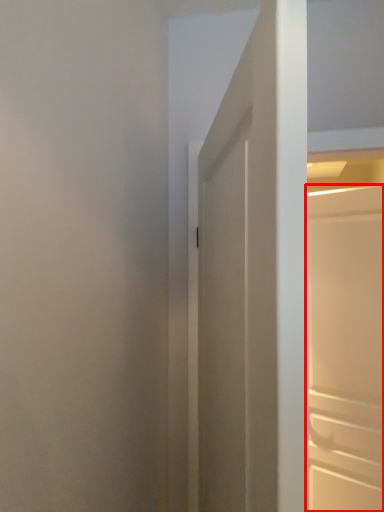
Question: From the image, what is the correct spatial relationship of door (annotated by the red box) in relation to door?

Choices:
 (A) left
 (B) right

Answer: (B)